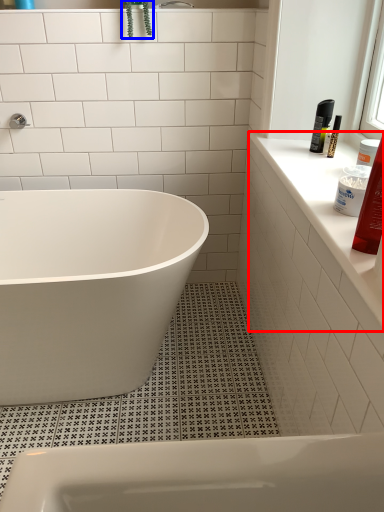
Question: Which of the following is the closest to the observer, window sill (highlighted by a red box) or plant (highlighted by a blue box)?

Choices:
 (A) window sill
 (B) plant

Answer: (A)